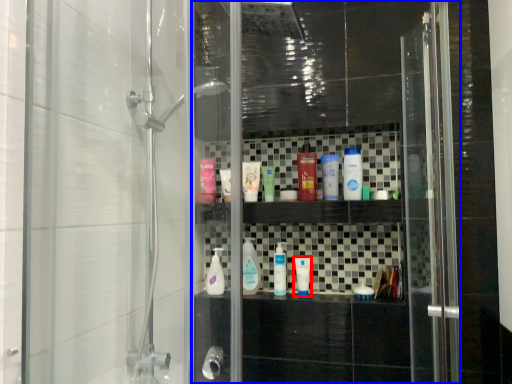
Question: Which object appears farthest to the camera in this image, toiletry (highlighted by a red box) or screen door (highlighted by a blue box)?

Choices:
 (A) toiletry
 (B) screen door

Answer: (A)